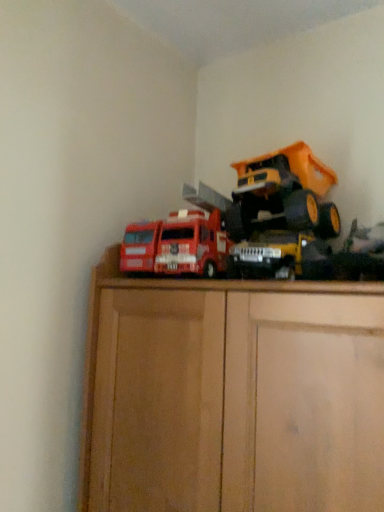
Question: Is metallic yellow truck at center, the 2th toy in the right-to-left sequence, touching matte red truck at center, the third toy from the right?

Choices:
 (A) no
 (B) yes

Answer: (A)

Question: Is metallic yellow truck at center, the 2th toy in the right-to-left sequence, shorter than matte red truck at center, the third toy from the right?

Choices:
 (A) yes
 (B) no

Answer: (A)

Question: Does metallic yellow truck at center, the 2th toy in the right-to-left sequence, have a larger size compared to matte red truck at center, the third toy from the right?

Choices:
 (A) no
 (B) yes

Answer: (A)

Question: Can you confirm if metallic yellow truck at center, the 2th toy in the right-to-left sequence, is smaller than matte red truck at center, which is the 1th toy from left to right?

Choices:
 (A) yes
 (B) no

Answer: (A)

Question: From the image's perspective, is metallic yellow truck at center, marked as the 2th toy in a left-to-right arrangement, above matte red truck at center, which is the 1th toy from left to right?

Choices:
 (A) yes
 (B) no

Answer: (B)

Question: Considering their positions, is metallic yellow truck at center, marked as the 2th toy in a left-to-right arrangement, located in front of or behind metallic yellow dump truck at upper right, which appears as the 3th toy when viewed from the left?

Choices:
 (A) front
 (B) behind

Answer: (A)

Question: In terms of size, does metallic yellow truck at center, marked as the 2th toy in a left-to-right arrangement, appear bigger or smaller than metallic yellow dump truck at upper right, which appears as the 3th toy when viewed from the left?

Choices:
 (A) small
 (B) big

Answer: (A)

Question: From a real-world perspective, is metallic yellow truck at center, marked as the 2th toy in a left-to-right arrangement, positioned above or below metallic yellow dump truck at upper right, which appears as the 3th toy when viewed from the left?

Choices:
 (A) above
 (B) below

Answer: (B)

Question: Do you think metallic yellow truck at center, the 2th toy in the right-to-left sequence, is within metallic yellow dump truck at upper right, which appears as the 3th toy when viewed from the left, or outside of it?

Choices:
 (A) outside
 (B) inside

Answer: (A)

Question: From their relative heights in the image, would you say metallic yellow dump truck at upper right, which ranks as the 1th toy in right-to-left order, is taller or shorter than matte red truck at center, the third toy from the right?

Choices:
 (A) short
 (B) tall

Answer: (B)

Question: Would you say metallic yellow dump truck at upper right, which appears as the 3th toy when viewed from the left, is inside or outside matte red truck at center, which is the 1th toy from left to right?

Choices:
 (A) outside
 (B) inside

Answer: (A)

Question: Based on their positions, is metallic yellow dump truck at upper right, which ranks as the 1th toy in right-to-left order, located to the left or right of matte red truck at center, the third toy from the right?

Choices:
 (A) right
 (B) left

Answer: (A)

Question: From a real-world perspective, is metallic yellow dump truck at upper right, which appears as the 3th toy when viewed from the left, above or below matte red truck at center, the third toy from the right?

Choices:
 (A) above
 (B) below

Answer: (A)

Question: Considering their positions, is metallic yellow dump truck at upper right, which appears as the 3th toy when viewed from the left, located in front of or behind metallic yellow truck at center, the 2th toy in the right-to-left sequence?

Choices:
 (A) front
 (B) behind

Answer: (B)

Question: Is point (253, 205) positioned closer to the camera than point (304, 240)?

Choices:
 (A) farther
 (B) closer

Answer: (A)